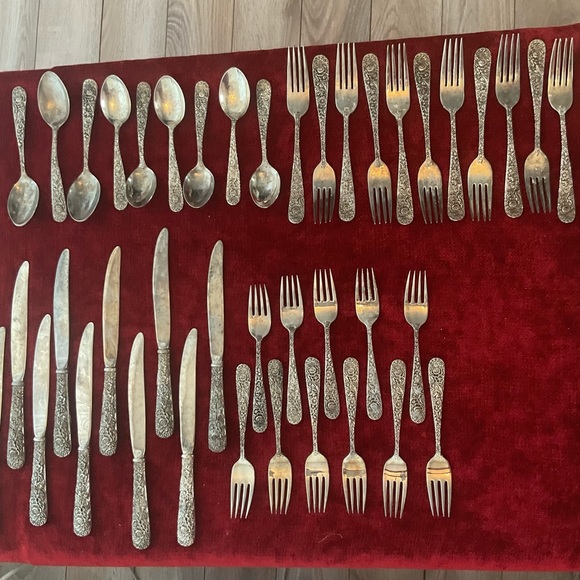
Where is `knives`? This screenshot has height=580, width=580. knives is located at coordinates (17, 334), (36, 371), (60, 334), (90, 372), (111, 317), (139, 380), (160, 303), (195, 376), (210, 329).